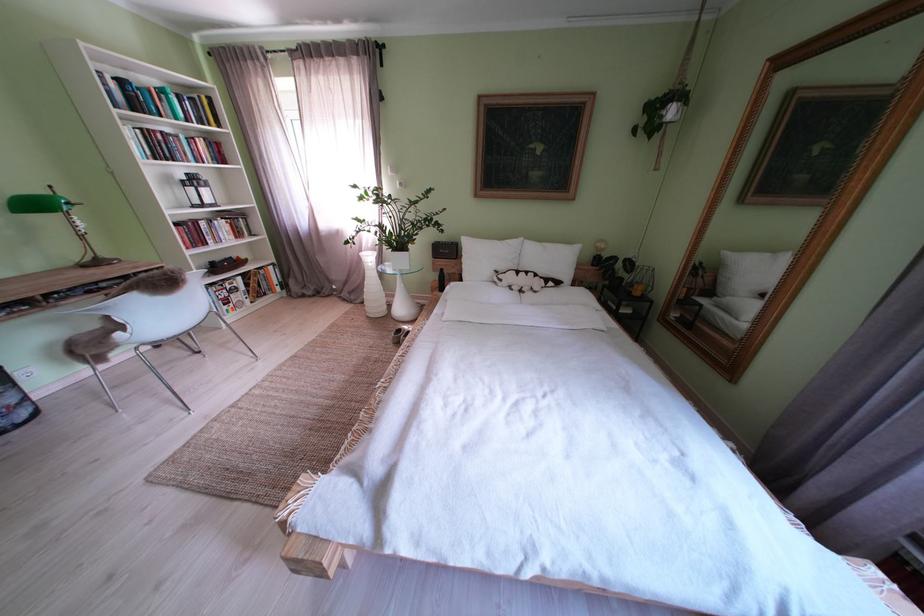
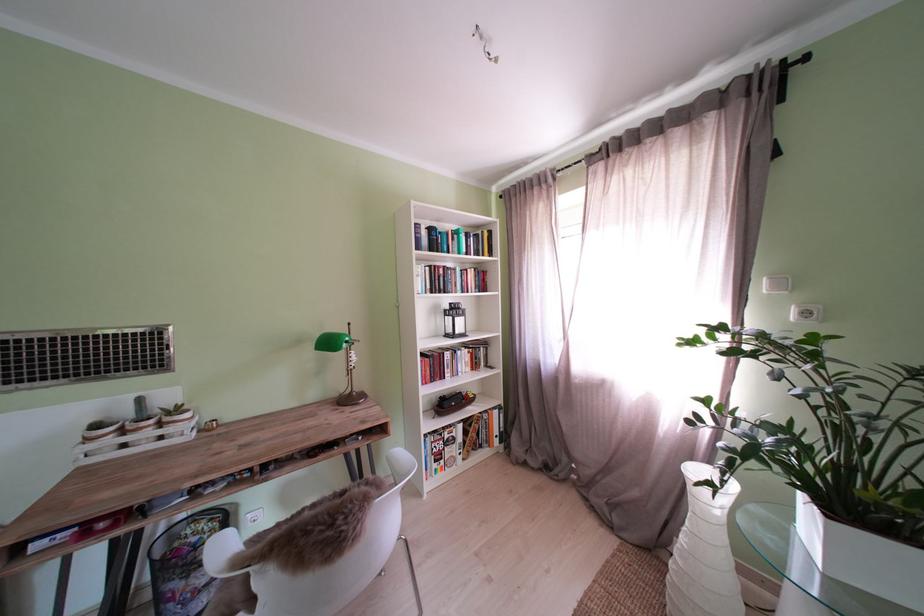
Where in the second image is the point corresponding to the point at 216,249 from the first image?

(454, 382)